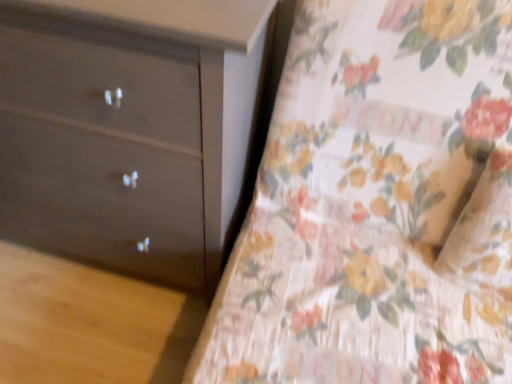
Question: Considering the positions of matte dark brown dresser at left and floral fabric bedspread at center in the image, is matte dark brown dresser at left wider or thinner than floral fabric bedspread at center?

Choices:
 (A) thin
 (B) wide

Answer: (A)

Question: From a real-world perspective, is matte dark brown dresser at left physically located above or below floral fabric bedspread at center?

Choices:
 (A) below
 (B) above

Answer: (A)

Question: Visually, is matte dark brown dresser at left positioned to the left or to the right of floral fabric bedspread at center?

Choices:
 (A) right
 (B) left

Answer: (B)

Question: Considering the positions of point (467, 24) and point (252, 77), is point (467, 24) closer or farther from the camera than point (252, 77)?

Choices:
 (A) farther
 (B) closer

Answer: (B)

Question: In the image, is floral fabric bedspread at center on the left side or the right side of matte dark brown dresser at left?

Choices:
 (A) right
 (B) left

Answer: (A)

Question: Looking at their shapes, would you say floral fabric bedspread at center is wider or thinner than matte dark brown dresser at left?

Choices:
 (A) thin
 (B) wide

Answer: (B)

Question: Is floral fabric bedspread at center inside or outside of matte dark brown dresser at left?

Choices:
 (A) outside
 (B) inside

Answer: (A)